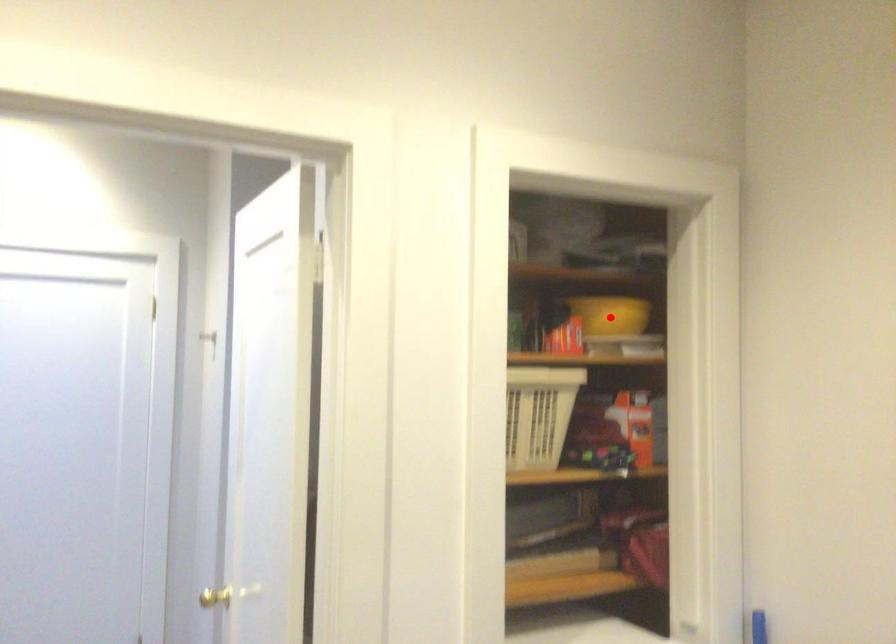
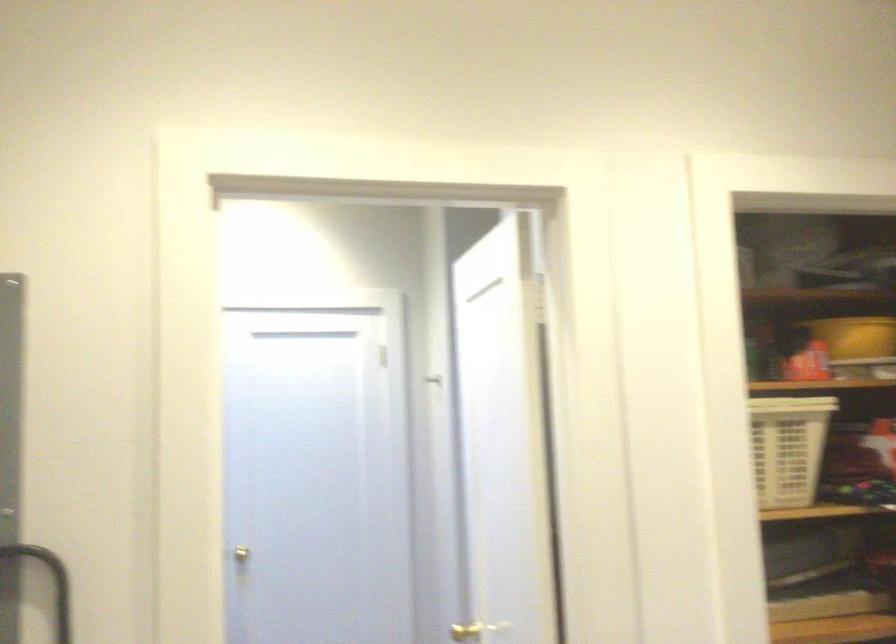
Question: I am providing you with two images of the same scene from different viewpoints. A red point is marked on the first image. At the location where the point appears in image 1, is it still visible in image 2?

Choices:
 (A) Yes
 (B) No

Answer: (A)